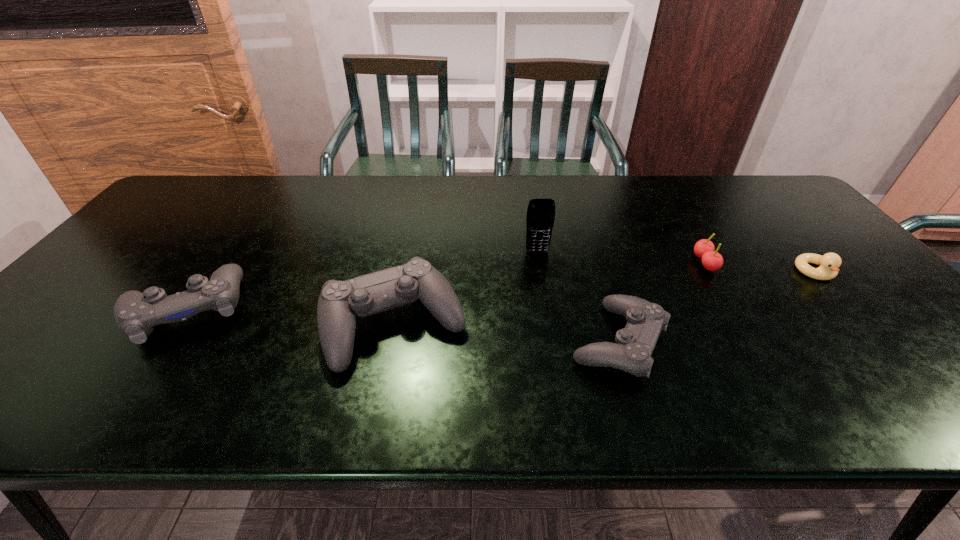
The image size is (960, 540). I want to click on vacant region at the far left corner, so click(x=204, y=199).

Find the location of a particular element. The image size is (960, 540). vacant area that lies between the rightmost control and the rightmost object is located at coordinates (717, 307).

Identify the location of free space that is in between the duckling and the cellular telephone. (677, 262).

You are a GUI agent. You are given a task and a screenshot of the screen. Output one action in this format:
    pyautogui.click(x=<x>, y=<y>)
    Task: Click on the vacant space that is in between the second shortest control and the shortest control
    This screenshot has height=540, width=960.
    Given the screenshot: What is the action you would take?
    pyautogui.click(x=402, y=325)

Locate an element on the screen. This screenshot has width=960, height=540. free space between the fifth object from left to right and the third object from right to left is located at coordinates (661, 302).

Locate an element on the screen. The width and height of the screenshot is (960, 540). vacant area between the second control from left to right and the leftmost object is located at coordinates (291, 317).

Locate an element on the screen. The image size is (960, 540). free area in between the leftmost object and the fifth object from right to left is located at coordinates (291, 317).

Identify the location of free space between the cherry and the cellular telephone. The image size is (960, 540). (621, 257).

Locate an element on the screen. The width and height of the screenshot is (960, 540). unoccupied area between the rightmost object and the second shortest control is located at coordinates point(501,291).

Locate which object ranks third in proximity to the fifth object from right to left. Please provide its 2D coordinates. Your answer should be formatted as a tuple, i.e. [(x, y)], where the tuple contains the x and y coordinates of a point satisfying the conditions above.

[(635, 343)]